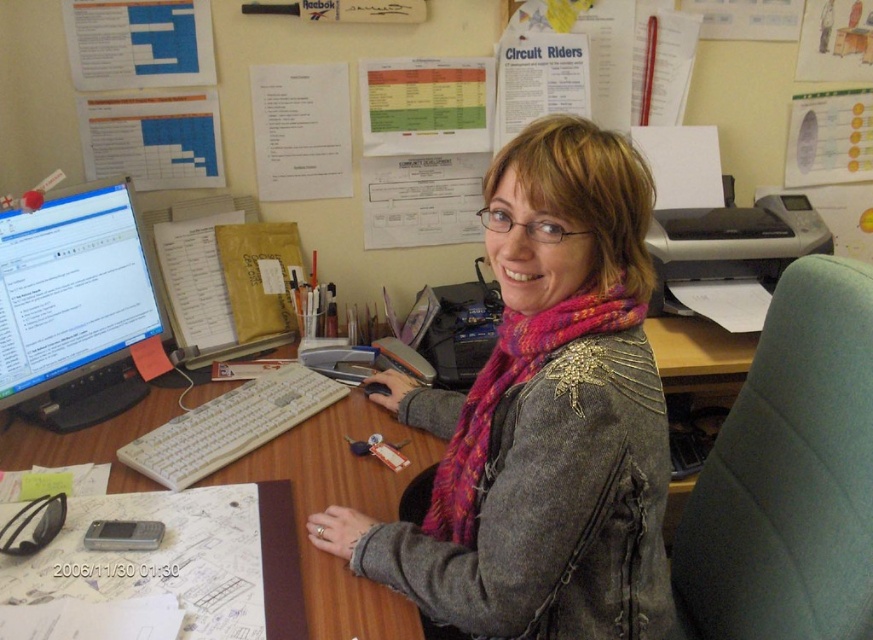
Question: Is green fabric swivel chair at right closer to camera compared to pink knitted scarf at center?

Choices:
 (A) no
 (B) yes

Answer: (A)

Question: Which is farther from the green fabric swivel chair at right?

Choices:
 (A) pink knitted scarf at center
 (B) white plastic keyboard at center
 (C) gray textured jacket at center

Answer: (B)

Question: Can you confirm if wooden desk at center is positioned to the left of black glossy monitor at left?

Choices:
 (A) yes
 (B) no

Answer: (B)

Question: Among these objects, which one is farthest from the camera?

Choices:
 (A) green fabric swivel chair at right
 (B) wooden desk at center

Answer: (B)

Question: Which object is farther from the camera taking this photo?

Choices:
 (A) green fabric swivel chair at right
 (B) gray textured jacket at center

Answer: (A)

Question: Can you confirm if gray textured jacket at center is positioned to the right of black glossy monitor at left?

Choices:
 (A) no
 (B) yes

Answer: (B)